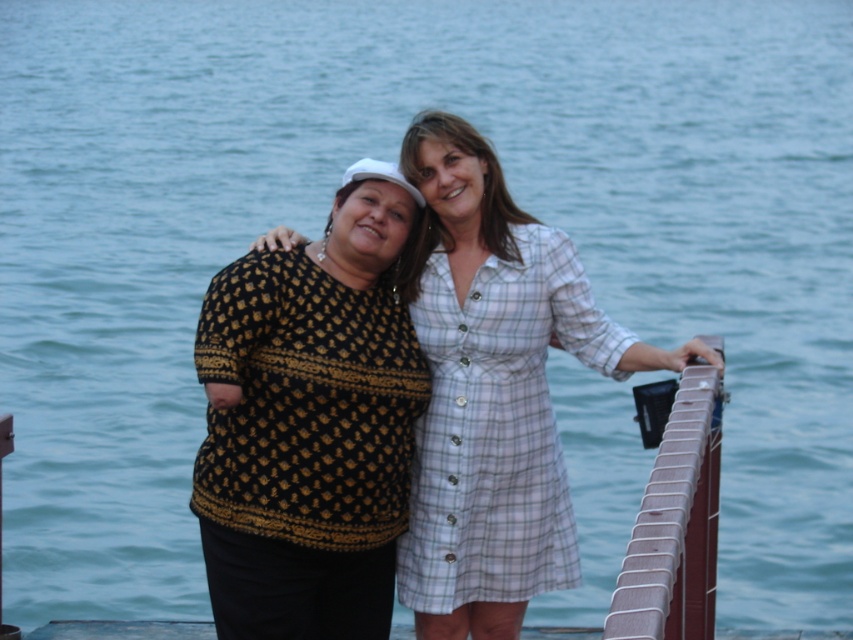
Question: Which point appears closest to the camera in this image?

Choices:
 (A) (426, 291)
 (B) (308, 380)
 (C) (645, 616)

Answer: (C)

Question: Which object is farther from the camera taking this photo?

Choices:
 (A) light blue plaid dress at center
 (B) black knitwear at center
 (C) black textured sweater at center
 (D) brown wooden rail at right

Answer: (A)

Question: In this image, where is black textured sweater at center located relative to brown wooden rail at right?

Choices:
 (A) above
 (B) below

Answer: (A)

Question: Does black textured sweater at center have a greater width compared to light blue plaid dress at center?

Choices:
 (A) yes
 (B) no

Answer: (A)

Question: Can you confirm if black textured sweater at center is bigger than brown wooden rail at right?

Choices:
 (A) no
 (B) yes

Answer: (B)

Question: Estimate the real-world distances between objects in this image. Which object is farther from the black textured sweater at center?

Choices:
 (A) light blue plaid dress at center
 (B) black knitwear at center

Answer: (B)